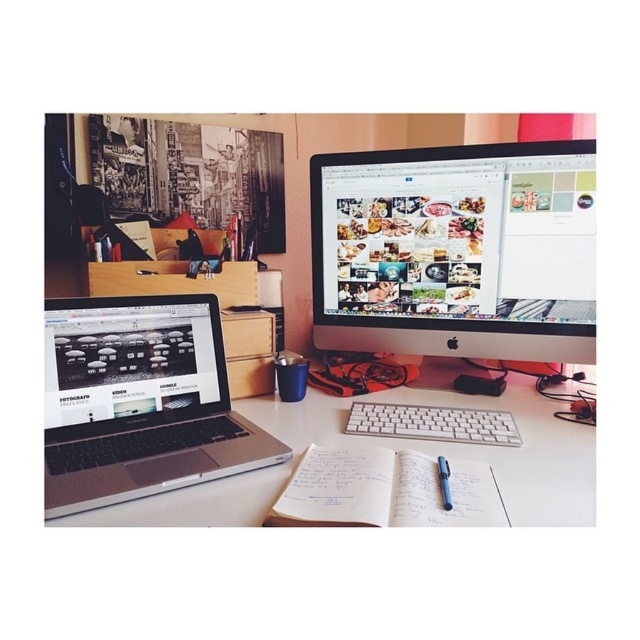
Consider the image. You are setting up a new desk arrangement and want to place a tall plant between the satin black monitor at upper center and the white paper notebook at center. Which object should the plant be placed closer to based on their heights?

The satin black monitor at upper center is much taller than the white paper notebook at center, so the plant should be placed closer to the white paper notebook at center to maintain balance in height.

You are setting up a new monitor that requires 2 feet of desk space. Given the white matte desk at center and the satin black laptop at lower left, can the monitor fit on the desk?

The white matte desk at center has a larger size compared to the satin black laptop at lower left, so there should be sufficient space to accommodate the new monitor requiring 2 feet of desk space.

You are setting up a new monitor in your workspace. You want to place the new monitor so that it is in front of the existing satin black laptop at lower left. Is the satin black monitor at upper center currently blocking the space where you want to place the new monitor?

The satin black laptop at lower left is behind the satin black monitor at upper center, so placing the new monitor in front of the existing laptop would require moving the current monitor out of the way since it is currently blocking that space.